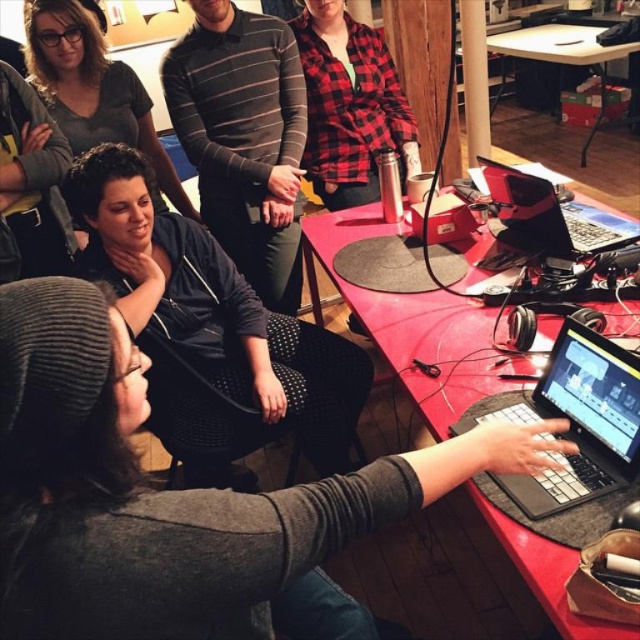
Question: Can you confirm if black matte jacket at center is thinner than red matte table at center?

Choices:
 (A) no
 (B) yes

Answer: (A)

Question: Which point is farther from the camera taking this photo?

Choices:
 (A) (221, 364)
 (B) (598, 60)
 (C) (3, 340)
 (D) (292, 260)

Answer: (B)

Question: Among these points, which one is farthest from the camera?

Choices:
 (A) (131, 195)
 (B) (524, 228)
 (C) (166, 83)
 (D) (381, 99)

Answer: (D)

Question: Does black matte jacket at center lie in front of striped cotton shirt at center?

Choices:
 (A) no
 (B) yes

Answer: (B)

Question: Which is farther from the gray knit beanie at upper left?

Choices:
 (A) wooden table at upper right
 (B) matte black jacket at upper left

Answer: (A)

Question: Does black matte jacket at center have a smaller size compared to red plaid shirt at center?

Choices:
 (A) no
 (B) yes

Answer: (A)